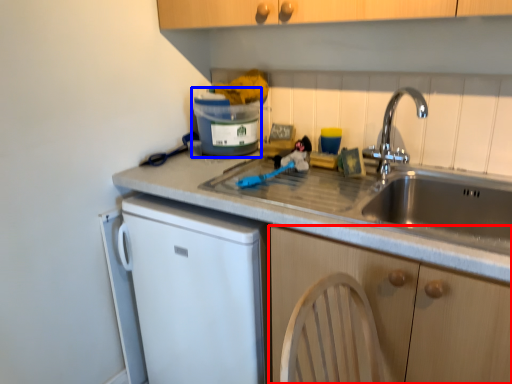
Question: Which point is closer to the camera, cabinetry (highlighted by a red box) or appliance (highlighted by a blue box)?

Choices:
 (A) cabinetry
 (B) appliance

Answer: (A)